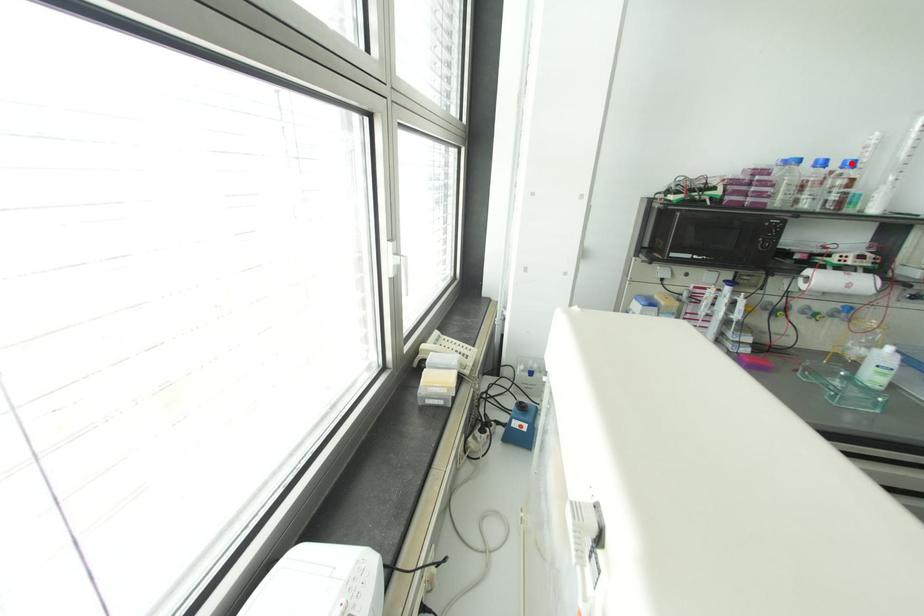
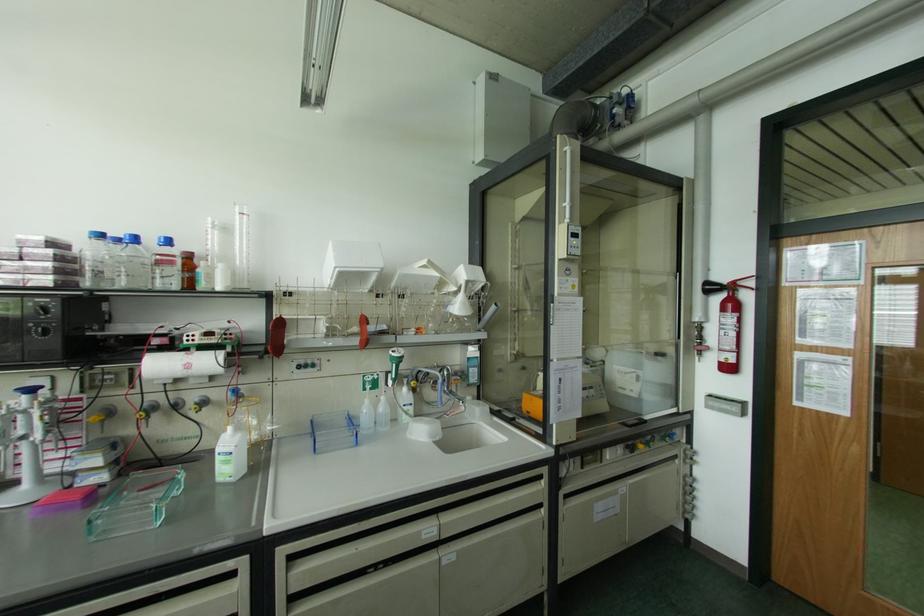
The point at the highlighted location is marked in the first image. Where is the corresponding point in the second image?

(167, 241)